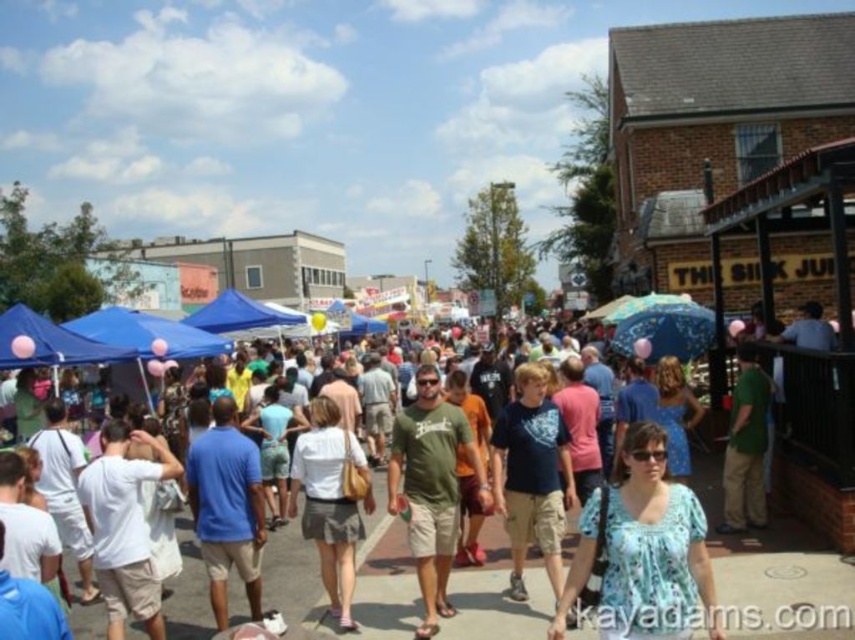
Between point (445, 484) and point (323, 572), which one is positioned in front?

Positioned in front is point (323, 572).

How far apart are green cotton t-shirt at center and white fabric skirt at center?

A distance of 6.29 meters exists between green cotton t-shirt at center and white fabric skirt at center.

Identify the location of green cotton t-shirt at center. (431, 486).

The image size is (855, 640). I want to click on green cotton t-shirt at center, so click(x=431, y=486).

Is point (768, 600) more distant than point (346, 508)?

No, it is not.

At what (x,y) coordinates should I click in order to perform the action: click on white cotton shirts at center. Please return your answer as a coordinate pair (x, y). The width and height of the screenshot is (855, 640). Looking at the image, I should click on (782, 592).

Locate an element on the screen. This screenshot has width=855, height=640. white cotton shirts at center is located at coordinates (782, 592).

What do you see at coordinates (782, 592) in the screenshot?
I see `white cotton shirts at center` at bounding box center [782, 592].

Which is behind, point (724, 556) or point (423, 483)?

The point (423, 483) is more distant.

Image resolution: width=855 pixels, height=640 pixels. Identify the location of white cotton shirts at center. point(782,592).